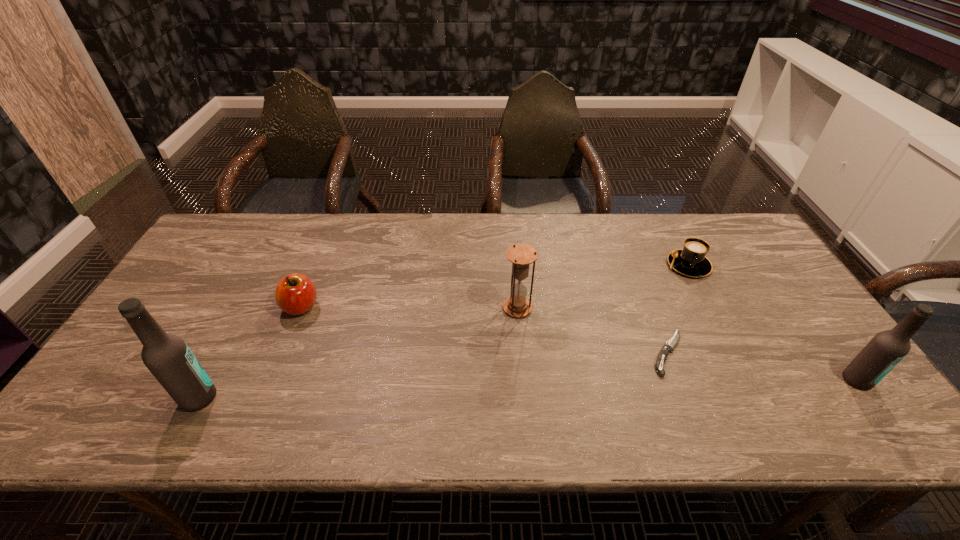
Identify the location of the left beer bottle. The width and height of the screenshot is (960, 540). (167, 356).

The height and width of the screenshot is (540, 960). Identify the location of the taller beer bottle. (167, 356).

This screenshot has width=960, height=540. I want to click on the right beer bottle, so click(x=886, y=349).

Image resolution: width=960 pixels, height=540 pixels. I want to click on the shorter beer bottle, so click(886, 349).

Where is `the second object from right to left`? the second object from right to left is located at coordinates (691, 261).

Find the location of a particular element. This screenshot has height=540, width=960. cappuccino is located at coordinates (691, 261).

Locate an element on the screen. The width and height of the screenshot is (960, 540). the fourth object from right to left is located at coordinates (521, 255).

Locate an element on the screen. The width and height of the screenshot is (960, 540). the third tallest object is located at coordinates point(521,255).

Image resolution: width=960 pixels, height=540 pixels. Find the location of `apple`. apple is located at coordinates (295, 294).

Where is `the second object from left to right`? the second object from left to right is located at coordinates (295, 294).